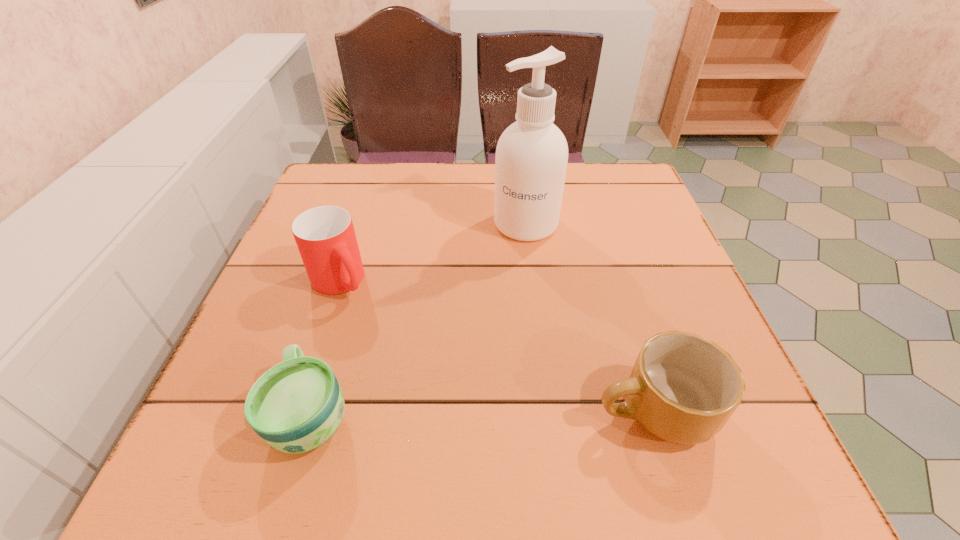
The height and width of the screenshot is (540, 960). I want to click on the closest object to the shorter cup, so click(325, 236).

Where is `vacant space that satisfies the following two spatial constraints: 1. on the front side of the second farthest object; 2. on the side with the handle of the mug`? The height and width of the screenshot is (540, 960). vacant space that satisfies the following two spatial constraints: 1. on the front side of the second farthest object; 2. on the side with the handle of the mug is located at coordinates (298, 410).

Find the location of `vacant space that satisfies the following two spatial constraints: 1. on the back side of the third nearest object; 2. on the right side of the tallest object`. vacant space that satisfies the following two spatial constraints: 1. on the back side of the third nearest object; 2. on the right side of the tallest object is located at coordinates (358, 224).

What are the coordinates of `vacant region that satisfies the following two spatial constraints: 1. on the back side of the nearer cup; 2. on the side with the handle of the mug` in the screenshot? It's located at (312, 410).

What are the coordinates of `vacant space that satisfies the following two spatial constraints: 1. on the front side of the taller cup; 2. on the right side of the shorter cup` in the screenshot? It's located at click(x=296, y=414).

Find the location of a particular element. free point that satisfies the following two spatial constraints: 1. on the back side of the mug; 2. on the side with the handle of the nearer cup is located at coordinates (312, 410).